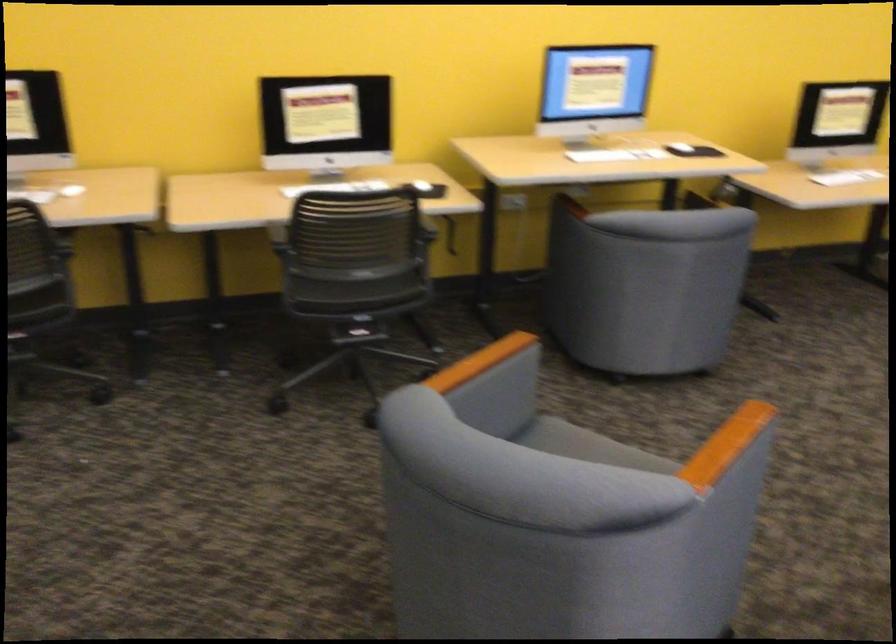
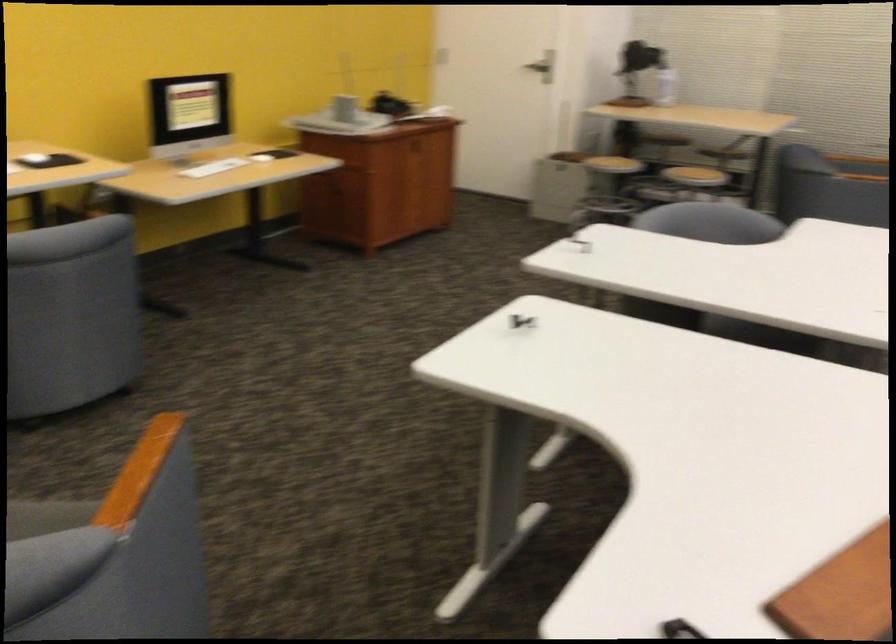
Question: The camera is either moving clockwise (left) or counter-clockwise (right) around the object. The first image is from the beginning of the video and the second image is from the end. Is the camera moving left or right when shooting the video?

Choices:
 (A) Left
 (B) Right

Answer: (A)